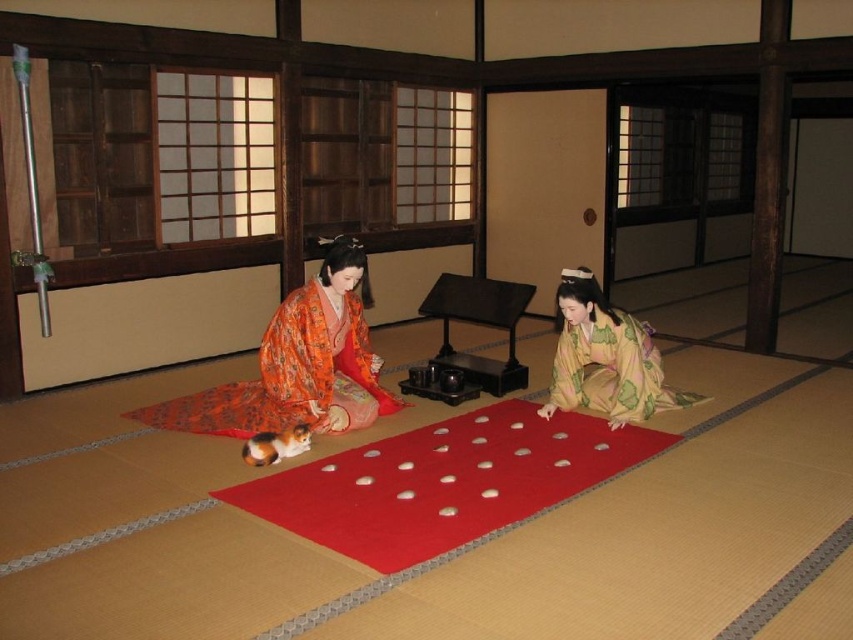
Consider the image. Is red felt mat at center to the left of yellow-green silk kimono at lower right from the viewer's perspective?

Yes, red felt mat at center is to the left of yellow-green silk kimono at lower right.

Does red felt mat at center have a lesser height compared to yellow-green silk kimono at lower right?

Yes, red felt mat at center is shorter than yellow-green silk kimono at lower right.

Locate an element on the screen. Image resolution: width=853 pixels, height=640 pixels. red felt mat at center is located at coordinates (444, 481).

In the scene shown: Which of these two, orange floral kimono at center or yellow-green silk kimono at lower right, stands taller?

Standing taller between the two is orange floral kimono at center.

Is orange floral kimono at center shorter than yellow-green silk kimono at lower right?

Incorrect, orange floral kimono at center's height does not fall short of yellow-green silk kimono at lower right's.

Which is in front, point (323, 371) or point (683, 401)?

Point (323, 371) is more forward.

The width and height of the screenshot is (853, 640). In order to click on orange floral kimono at center in this screenshot , I will do `click(299, 364)`.

Is red felt mat at center to the right of orange floral kimono at center from the viewer's perspective?

Yes, red felt mat at center is to the right of orange floral kimono at center.

Is point (238, 484) positioned in front of point (352, 401)?

Yes, it is.

Find the location of a particular element. This screenshot has width=853, height=640. red felt mat at center is located at coordinates (444, 481).